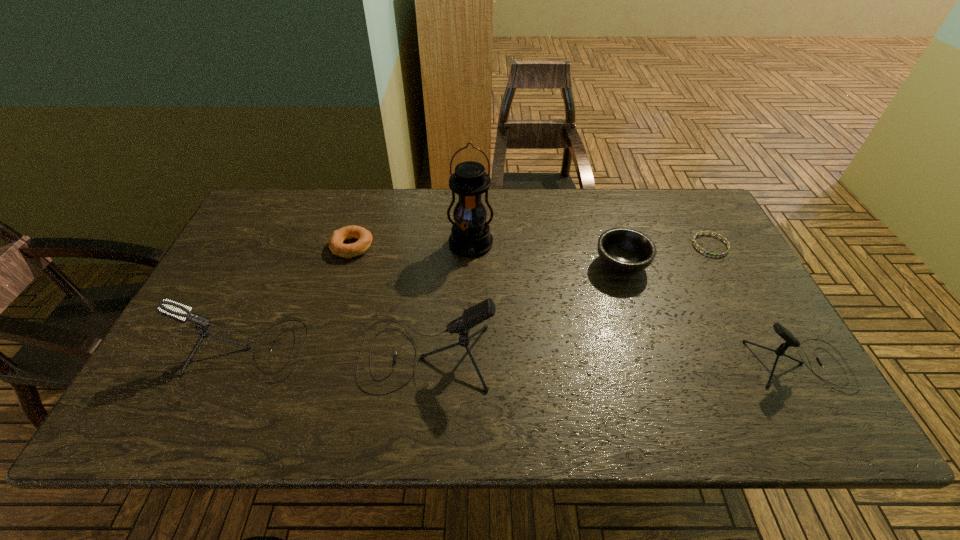
To make them evenly spaced by inserting another microphone among them, please locate a vacant spot for this new microphone. Please provide its 2D coordinates. Your answer should be formatted as a tuple, i.e. [(x, y)], where the tuple contains the x and y coordinates of a point satisfying the conditions above.

[(612, 360)]